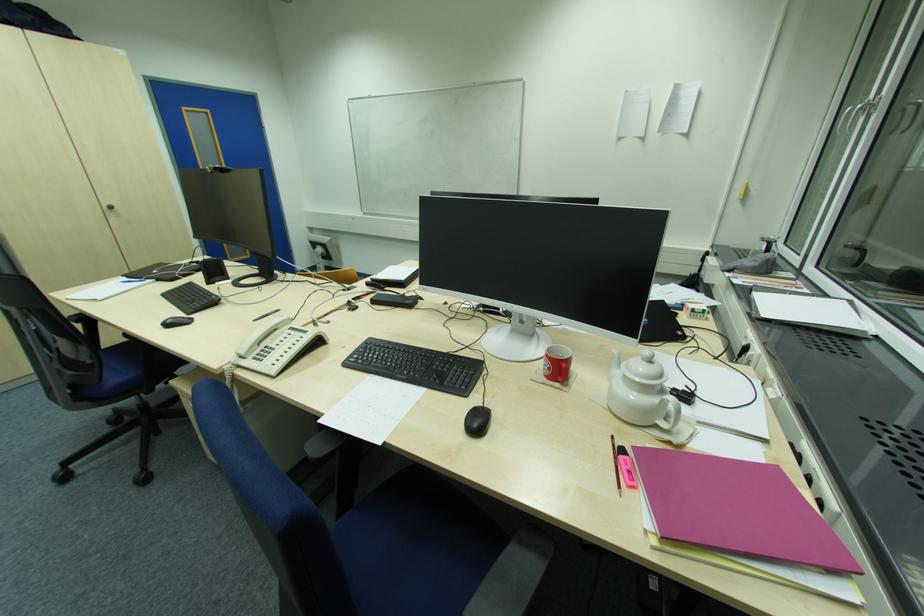
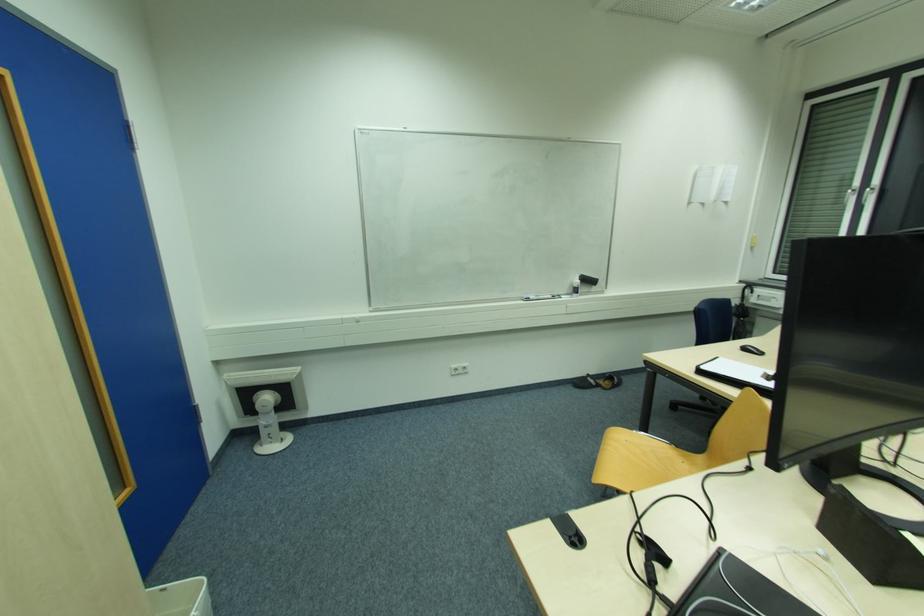
Locate, in the second image, the point that corresponds to the point at 850,111 in the first image.

(852, 191)